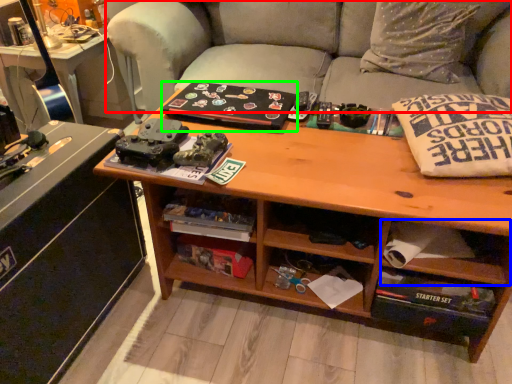
Question: Which object is the farthest from studio couch (highlighted by a red box)? Choose among these: drawer (highlighted by a blue box) or book (highlighted by a green box).

Choices:
 (A) drawer
 (B) book

Answer: (A)